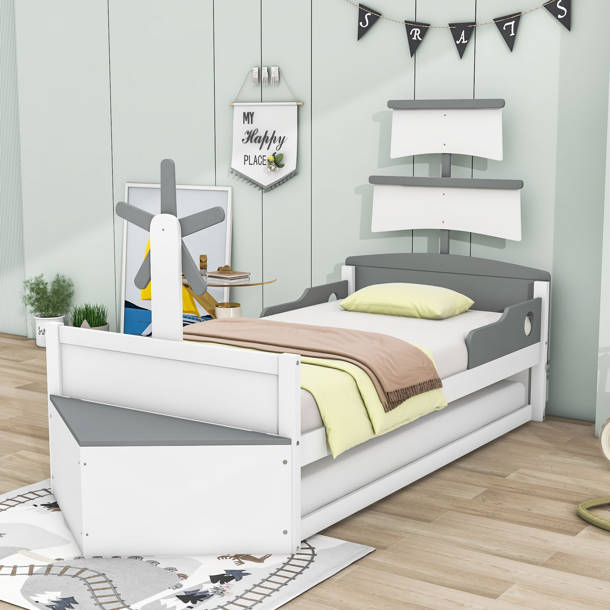
You are a GUI agent. You are given a task and a screenshot of the screen. Output one action in this format:
    pyautogui.click(x=<x>, y=<y>)
    Task: Click on the bed frame
    Image resolution: width=610 pixels, height=610 pixels.
    Given the screenshot: What is the action you would take?
    pyautogui.click(x=226, y=385)